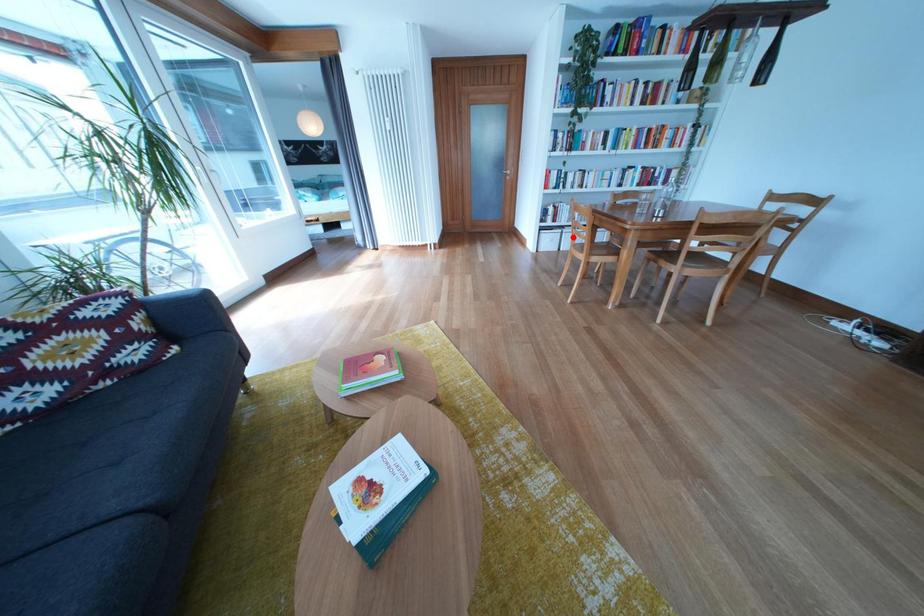
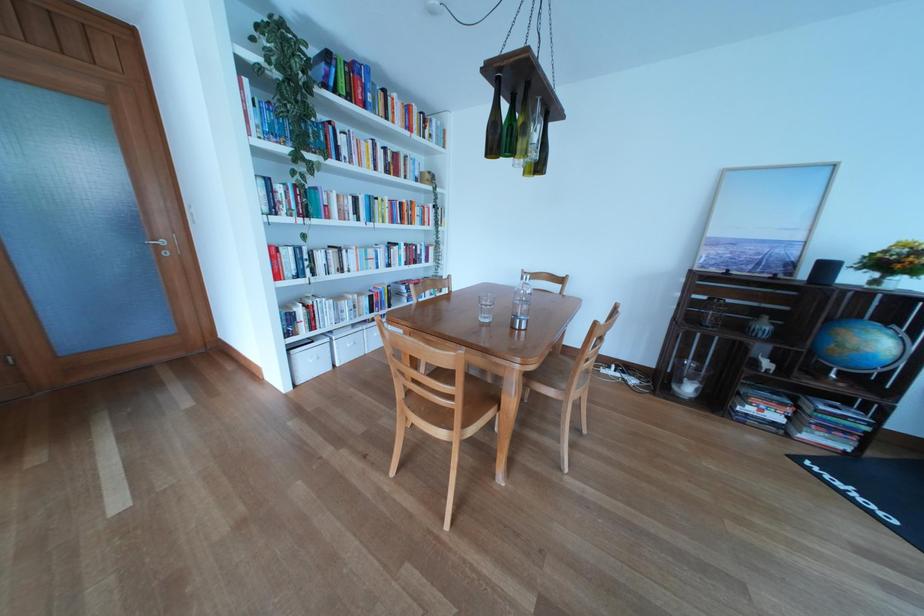
Question: I am providing you with two images of the same scene from different viewpoints. A red point is shown in image1. For the corresponding object point in image2, is it positioned nearer or farther from the camera?

Choices:
 (A) Nearer
 (B) Farther

Answer: (A)